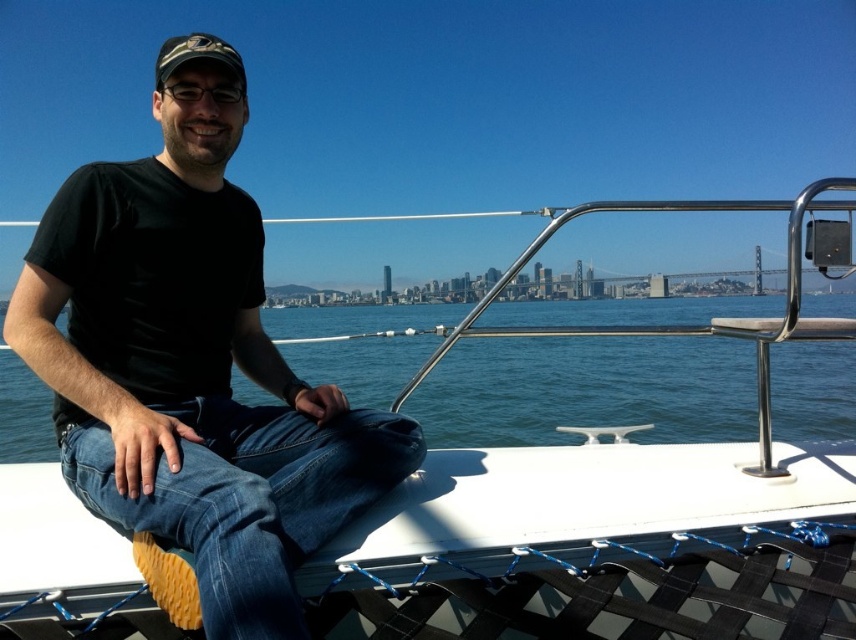
You are a photographer on a boat trip and want to capture a photo of the camouflage fabric baseball cap at upper left and the white matte boat at center. Which object should you focus on first if you want to ensure both are in sharp focus?

The white matte boat at center is closer to the viewer than the camouflage fabric baseball cap at upper left. To ensure both are in sharp focus, you should focus on the white matte boat at center first, as it is closer, and the camouflage fabric baseball cap at upper left will be within the depth of field if focused properly.